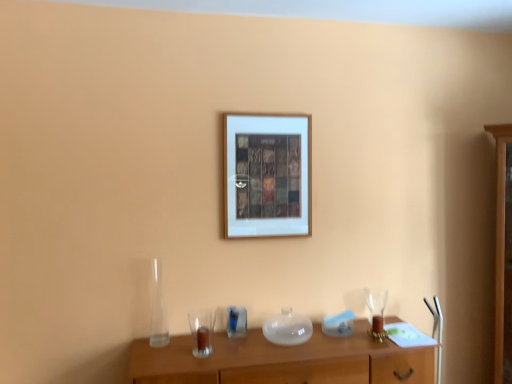
Question: Is white matte picture frame at center closer to the viewer compared to clear glass wine glass at right?

Choices:
 (A) yes
 (B) no

Answer: (B)

Question: Are white matte picture frame at center and clear glass wine glass at right far apart?

Choices:
 (A) no
 (B) yes

Answer: (A)

Question: From the image's perspective, is white matte picture frame at center under clear glass wine glass at right?

Choices:
 (A) yes
 (B) no

Answer: (B)

Question: Does white matte picture frame at center have a greater height compared to clear glass wine glass at right?

Choices:
 (A) no
 (B) yes

Answer: (B)

Question: Does white matte picture frame at center have a lesser height compared to clear glass wine glass at right?

Choices:
 (A) yes
 (B) no

Answer: (B)

Question: From a real-world perspective, is transparent glass vase at lower left positioned above or below wooden table at center?

Choices:
 (A) above
 (B) below

Answer: (A)

Question: Is transparent glass vase at lower left taller or shorter than wooden table at center?

Choices:
 (A) tall
 (B) short

Answer: (A)

Question: From the image's perspective, relative to wooden table at center, is transparent glass vase at lower left above or below?

Choices:
 (A) above
 (B) below

Answer: (A)

Question: Is transparent glass vase at lower left in front of or behind wooden table at center in the image?

Choices:
 (A) behind
 (B) front

Answer: (A)

Question: Considering their positions, is white matte picture frame at center located in front of or behind transparent glass vase at lower left?

Choices:
 (A) front
 (B) behind

Answer: (B)

Question: From the image's perspective, is white matte picture frame at center positioned above or below transparent glass vase at lower left?

Choices:
 (A) below
 (B) above

Answer: (B)

Question: Is white matte picture frame at center taller or shorter than transparent glass vase at lower left?

Choices:
 (A) tall
 (B) short

Answer: (A)

Question: Considering the positions of white matte picture frame at center and transparent glass vase at lower left in the image, is white matte picture frame at center wider or thinner than transparent glass vase at lower left?

Choices:
 (A) thin
 (B) wide

Answer: (A)

Question: From a real-world perspective, is transparent glass vase at lower left above or below clear glass wine glass at right?

Choices:
 (A) above
 (B) below

Answer: (A)

Question: Looking at their shapes, would you say transparent glass vase at lower left is wider or thinner than clear glass wine glass at right?

Choices:
 (A) wide
 (B) thin

Answer: (A)